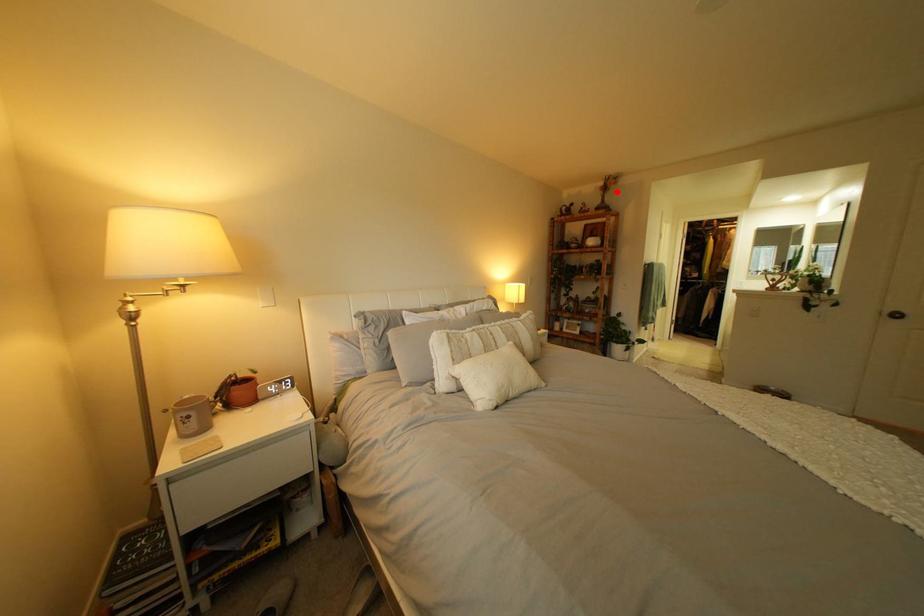
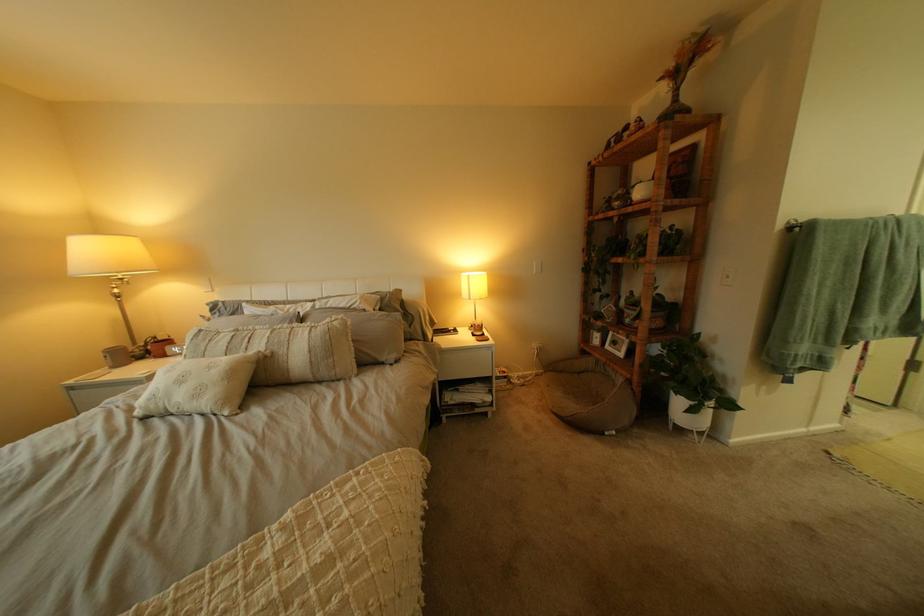
Find the pixel in the second image that matches the highlighted location in the first image.

(675, 81)